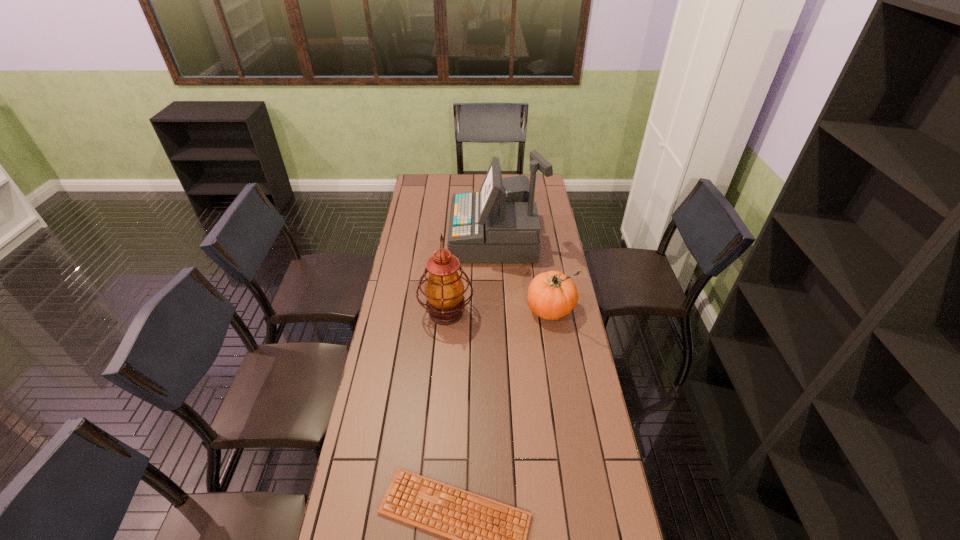
The width and height of the screenshot is (960, 540). In order to click on pumpkin that is positioned at the right edge in this screenshot , I will do `click(551, 295)`.

This screenshot has height=540, width=960. I want to click on vacant space at the left edge of the desktop, so click(402, 241).

Locate an element on the screen. The image size is (960, 540). free spot at the right edge of the desktop is located at coordinates (584, 516).

This screenshot has height=540, width=960. I want to click on vacant point at the far left corner, so click(x=415, y=187).

You are a GUI agent. You are given a task and a screenshot of the screen. Output one action in this format:
    pyautogui.click(x=<x>, y=<y>)
    Task: Click on the vacant space at the far right corner
    This screenshot has width=960, height=540.
    Given the screenshot: What is the action you would take?
    pyautogui.click(x=543, y=192)

At what (x,y) coordinates should I click in order to perform the action: click on vacant space that's between the oil lamp and the third tallest object. Please return your answer as a coordinate pair (x, y). Looking at the image, I should click on (498, 311).

At what (x,y) coordinates should I click in order to perform the action: click on vacant area between the third tallest object and the oil lamp. Please return your answer as a coordinate pair (x, y). This screenshot has width=960, height=540. Looking at the image, I should click on (498, 311).

Locate an element on the screen. This screenshot has width=960, height=540. vacant space in between the pumpkin and the third shortest object is located at coordinates (498, 311).

In order to click on unoccupied position between the pumpkin and the oil lamp in this screenshot , I will do [x=498, y=311].

Where is `vacant region between the farthest object and the oil lamp`? vacant region between the farthest object and the oil lamp is located at coordinates pos(471,276).